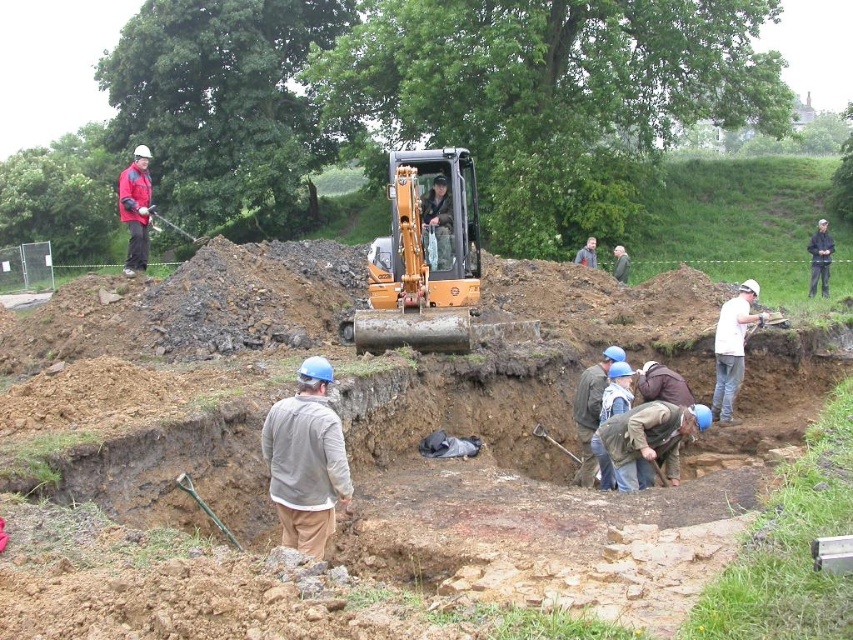
Which of these two, matte yellow excavator at upper center or white matte helmet at center, stands taller?

With more height is matte yellow excavator at upper center.

Looking at this image, can you confirm if matte yellow excavator at upper center is thinner than white matte helmet at center?

Incorrect, matte yellow excavator at upper center's width is not less than white matte helmet at center's.

In order to click on matte yellow excavator at upper center in this screenshot , I will do `click(376, 502)`.

Does matte yellow excavator at upper center appear on the left side of orange metallic excavator at center?

Indeed, matte yellow excavator at upper center is positioned on the left side of orange metallic excavator at center.

Is point (271, 387) closer to camera compared to point (437, 156)?

Yes, point (271, 387) is in front of point (437, 156).

Is point (30, 618) less distant than point (465, 179)?

Yes.

You are a GUI agent. You are given a task and a screenshot of the screen. Output one action in this format:
    pyautogui.click(x=<x>, y=<y>)
    Task: Click on the matte yellow excavator at upper center
    
    Given the screenshot: What is the action you would take?
    pyautogui.click(x=376, y=502)

Does orange metallic excavator at center have a lesser width compared to camouflage fabric jacket at center?

No, orange metallic excavator at center is not thinner than camouflage fabric jacket at center.

Who is more distant from viewer, (451,209) or (434,186)?

The point (451,209) is more distant.

At what (x,y) coordinates should I click in order to perform the action: click on orange metallic excavator at center. Please return your answer as a coordinate pair (x, y). The image size is (853, 640). Looking at the image, I should click on (428, 260).